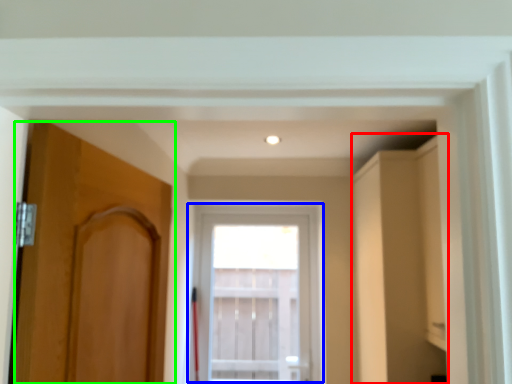
Question: Which object is positioned farthest from cabinetry (highlighted by a red box)? Select from window (highlighted by a blue box) and door (highlighted by a green box).

Choices:
 (A) window
 (B) door

Answer: (A)